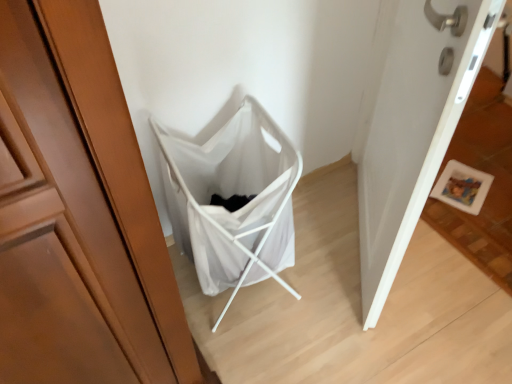
Question: From the image's perspective, is white fabric laundry basket at center located above or below white matte door at lower right?

Choices:
 (A) below
 (B) above

Answer: (A)

Question: From a real-world perspective, relative to white matte door at lower right, is white fabric laundry basket at center vertically above or below?

Choices:
 (A) above
 (B) below

Answer: (B)

Question: Considering their positions, is white fabric laundry basket at center located in front of or behind white matte door at lower right?

Choices:
 (A) behind
 (B) front

Answer: (A)

Question: Choose the correct answer: Is white matte door at lower right inside white fabric laundry basket at center or outside it?

Choices:
 (A) inside
 (B) outside

Answer: (B)

Question: Considering the positions of white matte door at lower right and white fabric laundry basket at center in the image, is white matte door at lower right taller or shorter than white fabric laundry basket at center?

Choices:
 (A) short
 (B) tall

Answer: (B)

Question: Considering the positions of white matte door at lower right and white fabric laundry basket at center in the image, is white matte door at lower right bigger or smaller than white fabric laundry basket at center?

Choices:
 (A) big
 (B) small

Answer: (A)

Question: Is point (400, 4) closer or farther from the camera than point (243, 180)?

Choices:
 (A) farther
 (B) closer

Answer: (B)